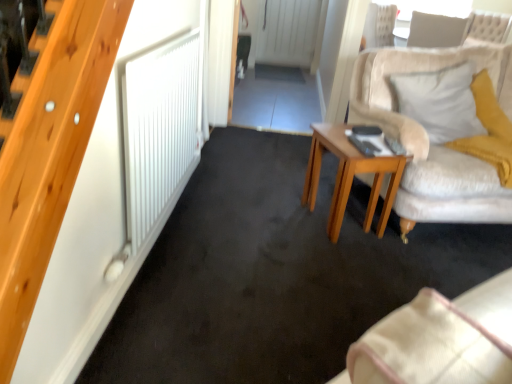
Question: From their relative heights in the image, would you say white fabric pillow at upper right, acting as the 2th pillow starting from the bottom, is taller or shorter than wooden side table at center?

Choices:
 (A) short
 (B) tall

Answer: (A)

Question: From a real-world perspective, is white fabric pillow at upper right, marked as the 2th pillow in a left-to-right arrangement, positioned above or below wooden side table at center?

Choices:
 (A) below
 (B) above

Answer: (B)

Question: Considering the real-world distances, which object is farthest from the wooden side table at center?

Choices:
 (A) white fabric pillow at upper right, the first pillow from the left
 (B) white fabric pillow at upper right, which is the second pillow in front-to-back order

Answer: (B)

Question: Based on their relative distances, which object is farther from the wooden side table at center?

Choices:
 (A) white fabric pillow at upper right, marked as the 1th pillow in a top-to-bottom arrangement
 (B) white fabric pillow at upper right, placed as the 2th pillow when sorted from right to left

Answer: (A)